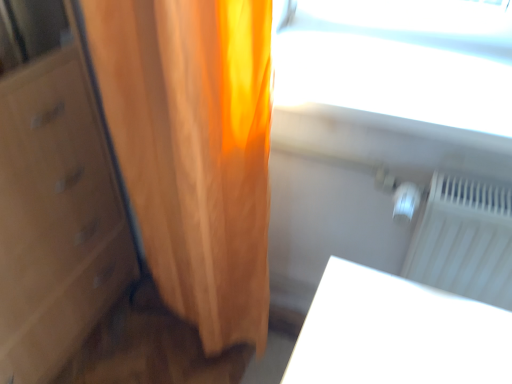
Looking at this image, what is the approximate width of matte wood dresser at left?

matte wood dresser at left is 17.92 inches in width.

The width and height of the screenshot is (512, 384). Find the location of `matte wood dresser at left`. matte wood dresser at left is located at coordinates (54, 194).

Describe the element at coordinates (54, 194) in the screenshot. I see `matte wood dresser at left` at that location.

Locate an element on the screen. The width and height of the screenshot is (512, 384). matte wood dresser at left is located at coordinates tap(54, 194).